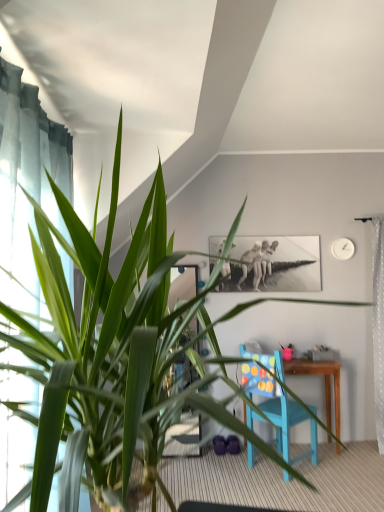
Image resolution: width=384 pixels, height=512 pixels. What do you see at coordinates (289, 424) in the screenshot? I see `matte blue chair at center` at bounding box center [289, 424].

Locate an element on the screen. matte blue chair at center is located at coordinates (289, 424).

What are the coordinates of `matte blue chair at center` in the screenshot? It's located at click(289, 424).